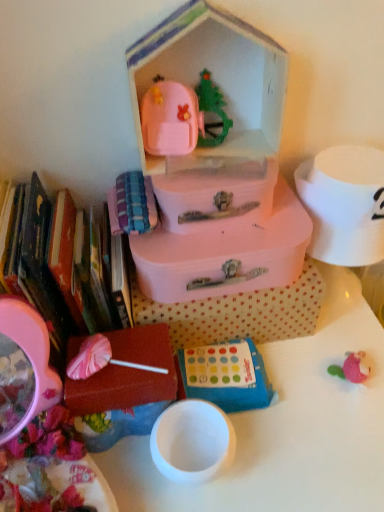
At what (x,y) coordinates should I click in order to perform the action: click on free space above matte pink suitcase at center, positioned as the 1th storage box in top-to-bottom order (from a real-world perspective). Please return your answer as a coordinate pair (x, y). Looking at the image, I should click on (220, 154).